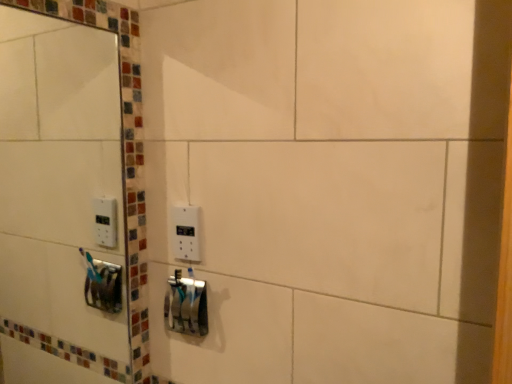
Question: Does metallic silver toothbrush holder at center have a greater width compared to white plastic light switch at center?

Choices:
 (A) yes
 (B) no

Answer: (A)

Question: Can we say metallic silver toothbrush holder at center lies outside white plastic light switch at center?

Choices:
 (A) no
 (B) yes

Answer: (B)

Question: Considering the relative sizes of metallic silver toothbrush holder at center and white plastic light switch at center in the image provided, is metallic silver toothbrush holder at center thinner than white plastic light switch at center?

Choices:
 (A) no
 (B) yes

Answer: (A)

Question: Considering the relative positions of metallic silver toothbrush holder at center and white plastic light switch at center in the image provided, is metallic silver toothbrush holder at center to the left of white plastic light switch at center from the viewer's perspective?

Choices:
 (A) yes
 (B) no

Answer: (A)

Question: Is metallic silver toothbrush holder at center at the right side of white plastic light switch at center?

Choices:
 (A) yes
 (B) no

Answer: (B)

Question: Could white plastic light switch at center be considered to be inside metallic silver toothbrush holder at center?

Choices:
 (A) yes
 (B) no

Answer: (B)

Question: Considering the relative sizes of metallic silver toothbrush holder at center and white glossy mirror at upper left in the image provided, is metallic silver toothbrush holder at center shorter than white glossy mirror at upper left?

Choices:
 (A) yes
 (B) no

Answer: (A)

Question: Does metallic silver toothbrush holder at center have a greater height compared to white glossy mirror at upper left?

Choices:
 (A) yes
 (B) no

Answer: (B)

Question: Considering the relative positions of metallic silver toothbrush holder at center and white glossy mirror at upper left in the image provided, is metallic silver toothbrush holder at center to the left of white glossy mirror at upper left from the viewer's perspective?

Choices:
 (A) yes
 (B) no

Answer: (B)

Question: Is metallic silver toothbrush holder at center positioned with its back to white glossy mirror at upper left?

Choices:
 (A) yes
 (B) no

Answer: (B)

Question: Does metallic silver toothbrush holder at center have a greater width compared to white glossy mirror at upper left?

Choices:
 (A) yes
 (B) no

Answer: (A)

Question: From the image's perspective, is metallic silver toothbrush holder at center located above white glossy mirror at upper left?

Choices:
 (A) yes
 (B) no

Answer: (B)

Question: Considering the relative sizes of white plastic light switch at center and white glossy mirror at upper left in the image provided, is white plastic light switch at center taller than white glossy mirror at upper left?

Choices:
 (A) no
 (B) yes

Answer: (A)